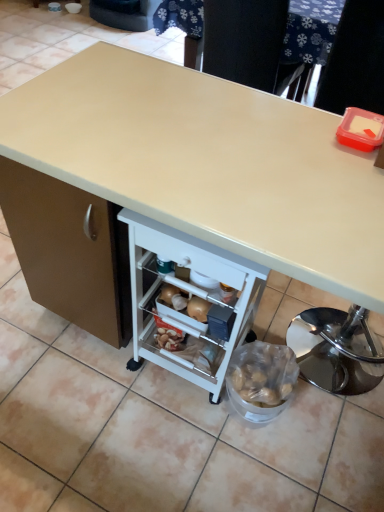
Image resolution: width=384 pixels, height=512 pixels. In order to click on beige laminate table at upper center in this screenshot , I will do `click(306, 42)`.

Image resolution: width=384 pixels, height=512 pixels. What do you see at coordinates (306, 42) in the screenshot?
I see `beige laminate table at upper center` at bounding box center [306, 42].

Measure the distance between point (312,207) and camera.

The depth of point (312,207) is 90.20 centimeters.

The width and height of the screenshot is (384, 512). What are the coordinates of `beige laminate desk at center` in the screenshot? It's located at (208, 163).

What is the approximate height of beige laminate desk at center?

beige laminate desk at center is 34.42 inches tall.

The width and height of the screenshot is (384, 512). What do you see at coordinates (208, 163) in the screenshot?
I see `beige laminate desk at center` at bounding box center [208, 163].

Locate an element on the screen. beige laminate table at upper center is located at coordinates (306, 42).

Visually, is beige laminate table at upper center positioned to the left or to the right of beige laminate desk at center?

From the image, it's evident that beige laminate table at upper center is to the right of beige laminate desk at center.

In the image, is beige laminate table at upper center positioned in front of or behind beige laminate desk at center?

beige laminate table at upper center is positioned farther from the viewer than beige laminate desk at center.

Which is nearer, (289, 91) or (128, 78)?

Point (289, 91) is positioned farther from the camera compared to point (128, 78).

From the image's perspective, between beige laminate table at upper center and beige laminate desk at center, who is located below?

beige laminate desk at center.

From a real-world perspective, is beige laminate table at upper center on top of beige laminate desk at center?

Correct, in the physical world, beige laminate table at upper center is higher than beige laminate desk at center.

Can you confirm if beige laminate table at upper center is wider than beige laminate desk at center?

No, beige laminate table at upper center is not wider than beige laminate desk at center.

Considering the sizes of objects beige laminate table at upper center and beige laminate desk at center in the image provided, who is shorter, beige laminate table at upper center or beige laminate desk at center?

beige laminate table at upper center.

Considering the sizes of beige laminate table at upper center and beige laminate desk at center in the image, is beige laminate table at upper center bigger or smaller than beige laminate desk at center?

In the image, beige laminate table at upper center appears to be smaller than beige laminate desk at center.

Is beige laminate table at upper center not inside beige laminate desk at center?

beige laminate table at upper center lies outside beige laminate desk at center's area.

Is beige laminate table at upper center far from beige laminate desk at center?

Yes.

Is beige laminate table at upper center facing away from beige laminate desk at center?

Yes, beige laminate table at upper center is positioned with its back facing beige laminate desk at center.

Find the location of `table on the right side of beige laminate desk at center`. table on the right side of beige laminate desk at center is located at coordinates (306, 42).

Which object is positioned more to the right, beige laminate desk at center or beige laminate table at upper center?

From the viewer's perspective, beige laminate table at upper center appears more on the right side.

Relative to beige laminate table at upper center, is beige laminate desk at center in front or behind?

Clearly, beige laminate desk at center is in front of beige laminate table at upper center.

Is point (285, 215) closer to camera compared to point (309, 21)?

Yes, it is.

From the image's perspective, is beige laminate desk at center located beneath beige laminate table at upper center?

Yes, from the image's perspective, beige laminate desk at center is below beige laminate table at upper center.

From a real-world perspective, is beige laminate desk at center beneath beige laminate table at upper center?

Yes, from a real-world perspective, beige laminate desk at center is under beige laminate table at upper center.

Which object is wider, beige laminate desk at center or beige laminate table at upper center?

beige laminate desk at center.

Can you confirm if beige laminate desk at center is shorter than beige laminate table at upper center?

No, beige laminate desk at center is not shorter than beige laminate table at upper center.

Is beige laminate desk at center bigger or smaller than beige laminate table at upper center?

Considering their sizes, beige laminate desk at center takes up more space than beige laminate table at upper center.

Would you say beige laminate desk at center is outside beige laminate table at upper center?

Yes, beige laminate desk at center is not within beige laminate table at upper center.

Can you see beige laminate desk at center touching beige laminate table at upper center?

No.

Consider the image. Is beige laminate table at upper center at the back of beige laminate desk at center?

No, beige laminate table at upper center is not at the back of beige laminate desk at center.

Can you tell me how much beige laminate desk at center and beige laminate table at upper center differ in facing direction?

There is a 91.6-degree angle between the facing directions of beige laminate desk at center and beige laminate table at upper center.

The image size is (384, 512). What are the coordinates of `table above the beige laminate desk at center (from the image's perspective)` in the screenshot? It's located at (306, 42).

At what (x,y) coordinates should I click in order to perform the action: click on desk lying below the beige laminate table at upper center (from the image's perspective). Please return your answer as a coordinate pair (x, y). Looking at the image, I should click on (208, 163).

Where is `table behind the beige laminate desk at center`? This screenshot has height=512, width=384. table behind the beige laminate desk at center is located at coordinates [x=306, y=42].